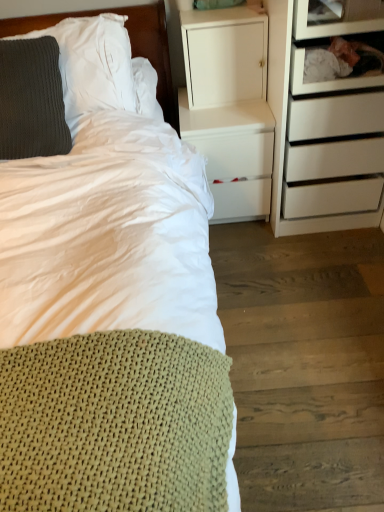
Identify the location of white matte nightstand at center. The width and height of the screenshot is (384, 512). (229, 106).

Locate an element on the screen. The image size is (384, 512). transparent glass shelf at upper right, which ranks as the 1th shelf in top-to-bottom order is located at coordinates (332, 24).

What is the approximate width of knitted gray pillow at left, which is the 1th pillow in top-to-bottom order?

knitted gray pillow at left, which is the 1th pillow in top-to-bottom order, is 18.86 inches wide.

Locate an element on the screen. wooden drawer at upper right, positioned as the 1th shelf in bottom-to-top order is located at coordinates (324, 81).

Would you say wooden drawer at upper right, positioned as the 1th shelf in bottom-to-top order, is a long distance from transparent glass shelf at upper right, which ranks as the 1th shelf in top-to-bottom order?

No, wooden drawer at upper right, positioned as the 1th shelf in bottom-to-top order, is in close proximity to transparent glass shelf at upper right, which ranks as the 1th shelf in top-to-bottom order.

Based on the photo, which object is positioned more to the right, wooden drawer at upper right, positioned as the 1th shelf in bottom-to-top order, or transparent glass shelf at upper right, which ranks as the 1th shelf in top-to-bottom order?

Positioned to the right is wooden drawer at upper right, positioned as the 1th shelf in bottom-to-top order.

Considering the positions of point (381, 81) and point (346, 23), is point (381, 81) closer or farther from the camera than point (346, 23)?

Clearly, point (381, 81) is more distant from the camera than point (346, 23).

Considering the positions of points (213, 46) and (349, 33), is point (213, 46) closer to camera compared to point (349, 33)?

No, it is not.

Considering the relative sizes of white matte cabinet at upper center and transparent glass shelf at upper right, the second shelf ordered from the bottom, in the image provided, is white matte cabinet at upper center wider than transparent glass shelf at upper right, the second shelf ordered from the bottom,?

No, white matte cabinet at upper center is not wider than transparent glass shelf at upper right, the second shelf ordered from the bottom.

Is white matte cabinet at upper center not close to transparent glass shelf at upper right, the second shelf ordered from the bottom?

That's not correct — white matte cabinet at upper center is a little close to transparent glass shelf at upper right, the second shelf ordered from the bottom.

Would you say knitted green blanket at lower left is a long distance from wooden drawer at upper right, positioned as the 1th shelf in bottom-to-top order?

Actually, knitted green blanket at lower left and wooden drawer at upper right, positioned as the 1th shelf in bottom-to-top order, are a little close together.

Find the location of a particular element. shelf that is the 1st one when counting upward from the knitted green blanket at lower left (from the image's perspective) is located at coordinates (324, 81).

From a real-world perspective, which object stands above the other?

wooden drawer at upper right, positioned as the 1th shelf in bottom-to-top order, from a real-world perspective.

Considering the sizes of objects knitted green blanket at lower left and wooden drawer at upper right, positioned as the 1th shelf in bottom-to-top order, in the image provided, who is smaller, knitted green blanket at lower left or wooden drawer at upper right, positioned as the 1th shelf in bottom-to-top order,?

Smaller between the two is wooden drawer at upper right, positioned as the 1th shelf in bottom-to-top order.

Which of these two, dark gray knitted pillow at upper left, the 2th pillow from the top, or knitted gray pillow at left, which ranks as the 2th pillow in bottom-to-top order, is thinner?

dark gray knitted pillow at upper left, the 2th pillow from the top, is thinner.

Is dark gray knitted pillow at upper left, positioned as the 1th pillow in bottom-to-top order, bigger than knitted gray pillow at left, which is the 1th pillow in top-to-bottom order?

Incorrect, dark gray knitted pillow at upper left, positioned as the 1th pillow in bottom-to-top order, is not larger than knitted gray pillow at left, which is the 1th pillow in top-to-bottom order.

Considering the positions of objects dark gray knitted pillow at upper left, the 2th pillow from the top, and knitted gray pillow at left, which is the 1th pillow in top-to-bottom order, in the image provided, who is behind, dark gray knitted pillow at upper left, the 2th pillow from the top, or knitted gray pillow at left, which is the 1th pillow in top-to-bottom order,?

knitted gray pillow at left, which is the 1th pillow in top-to-bottom order, is further from the camera.

Is dark gray knitted pillow at upper left, positioned as the 1th pillow in bottom-to-top order, thinner than wooden drawer at upper right, the 2th shelf from the top?

No, dark gray knitted pillow at upper left, positioned as the 1th pillow in bottom-to-top order, is not thinner than wooden drawer at upper right, the 2th shelf from the top.

Identify the location of the 1st pillow located above the wooden drawer at upper right, the 2th shelf from the top (from a real-world perspective). The width and height of the screenshot is (384, 512). [x=31, y=100].

From the image's perspective, would you say dark gray knitted pillow at upper left, positioned as the 1th pillow in bottom-to-top order, is shown under wooden drawer at upper right, the 2th shelf from the top?

Yes.

Is dark gray knitted pillow at upper left, the 2th pillow from the top, next to wooden drawer at upper right, positioned as the 1th shelf in bottom-to-top order, and touching it?

No, dark gray knitted pillow at upper left, the 2th pillow from the top, is not with wooden drawer at upper right, positioned as the 1th shelf in bottom-to-top order.

Is the position of transparent glass shelf at upper right, which ranks as the 1th shelf in top-to-bottom order, less distant than that of knitted green blanket at lower left?

No, transparent glass shelf at upper right, which ranks as the 1th shelf in top-to-bottom order, is behind knitted green blanket at lower left.

From the image's perspective, is transparent glass shelf at upper right, which ranks as the 1th shelf in top-to-bottom order, above knitted green blanket at lower left?

Yes.

Can you tell me how much transparent glass shelf at upper right, which ranks as the 1th shelf in top-to-bottom order, and knitted green blanket at lower left differ in facing direction?

0.154 degrees.

Visually, is transparent glass shelf at upper right, which ranks as the 1th shelf in top-to-bottom order, positioned to the left or to the right of knitted green blanket at lower left?

Clearly, transparent glass shelf at upper right, which ranks as the 1th shelf in top-to-bottom order, is on the right of knitted green blanket at lower left in the image.

Between wooden drawer at upper right, the 2th shelf from the top, and knitted gray pillow at left, which is the 1th pillow in top-to-bottom order, which one has larger size?

knitted gray pillow at left, which is the 1th pillow in top-to-bottom order, is bigger.

Locate an element on the screen. This screenshot has width=384, height=512. pillow that is the 2nd object above the wooden drawer at upper right, the 2th shelf from the top (from a real-world perspective) is located at coordinates (93, 64).

From the image's perspective, is wooden drawer at upper right, the 2th shelf from the top, located beneath knitted gray pillow at left, which ranks as the 2th pillow in bottom-to-top order?

Actually, wooden drawer at upper right, the 2th shelf from the top, appears above knitted gray pillow at left, which ranks as the 2th pillow in bottom-to-top order, in the image.

Can you confirm if wooden drawer at upper right, the 2th shelf from the top, is taller than knitted gray pillow at left, which is the 1th pillow in top-to-bottom order?

No, wooden drawer at upper right, the 2th shelf from the top, is not taller than knitted gray pillow at left, which is the 1th pillow in top-to-bottom order.

Where is `shelf located underneath the transparent glass shelf at upper right, the second shelf ordered from the bottom (from a real-world perspective)`? This screenshot has width=384, height=512. shelf located underneath the transparent glass shelf at upper right, the second shelf ordered from the bottom (from a real-world perspective) is located at coordinates (324, 81).

Find the location of a particular element. This screenshot has width=384, height=512. cabinetry that appears on the left of transparent glass shelf at upper right, which ranks as the 1th shelf in top-to-bottom order is located at coordinates (224, 56).

Considering their positions, is transparent glass shelf at upper right, which ranks as the 1th shelf in top-to-bottom order, positioned closer to white matte nightstand at center than wooden drawer at upper right, positioned as the 1th shelf in bottom-to-top order?

The object closer to white matte nightstand at center is wooden drawer at upper right, positioned as the 1th shelf in bottom-to-top order.

Estimate the real-world distances between objects in this image. Which object is further from white matte cabinet at upper center, knitted gray pillow at left, which ranks as the 2th pillow in bottom-to-top order, or dark gray knitted pillow at upper left, the 2th pillow from the top?

dark gray knitted pillow at upper left, the 2th pillow from the top, is further to white matte cabinet at upper center.

In the scene shown: Which object lies further to the anchor point wooden drawer at upper right, positioned as the 1th shelf in bottom-to-top order, white matte nightstand at center or knitted gray pillow at left, which is the 1th pillow in top-to-bottom order?

knitted gray pillow at left, which is the 1th pillow in top-to-bottom order.

Based on their spatial positions, is white matte nightstand at center or wooden drawer at upper right, positioned as the 1th shelf in bottom-to-top order, closer to knitted gray pillow at left, which is the 1th pillow in top-to-bottom order?

white matte nightstand at center.

When comparing their distances from white matte cabinet at upper center, does transparent glass shelf at upper right, which ranks as the 1th shelf in top-to-bottom order, or wooden drawer at upper right, the 2th shelf from the top, seem closer?

wooden drawer at upper right, the 2th shelf from the top, is positioned closer to the anchor white matte cabinet at upper center.

Which object lies further to the anchor point dark gray knitted pillow at upper left, positioned as the 1th pillow in bottom-to-top order, knitted green blanket at lower left or transparent glass shelf at upper right, the second shelf ordered from the bottom?

transparent glass shelf at upper right, the second shelf ordered from the bottom.

Looking at the image, which one is located further to wooden drawer at upper right, the 2th shelf from the top, dark gray knitted pillow at upper left, positioned as the 1th pillow in bottom-to-top order, or white matte nightstand at center?

dark gray knitted pillow at upper left, positioned as the 1th pillow in bottom-to-top order.

Looking at the image, which one is located further to wooden drawer at upper right, the 2th shelf from the top, knitted gray pillow at left, which is the 1th pillow in top-to-bottom order, or knitted green blanket at lower left?

The object further to wooden drawer at upper right, the 2th shelf from the top, is knitted green blanket at lower left.

Locate an element on the screen. cabinetry located between knitted gray pillow at left, which ranks as the 2th pillow in bottom-to-top order, and wooden drawer at upper right, positioned as the 1th shelf in bottom-to-top order, in the left-right direction is located at coordinates coord(224,56).

You are a GUI agent. You are given a task and a screenshot of the screen. Output one action in this format:
    pyautogui.click(x=<x>, y=<y>)
    Task: Click on the nightstand located between knitted gray pillow at left, which is the 1th pillow in top-to-bottom order, and wooden drawer at upper right, positioned as the 1th shelf in bottom-to-top order, in the left-right direction
    This screenshot has height=512, width=384.
    Given the screenshot: What is the action you would take?
    click(x=229, y=106)

Identify the location of nightstand situated between knitted gray pillow at left, which ranks as the 2th pillow in bottom-to-top order, and transparent glass shelf at upper right, which ranks as the 1th shelf in top-to-bottom order, from left to right. The width and height of the screenshot is (384, 512). (229, 106).

Locate an element on the screen. The height and width of the screenshot is (512, 384). pillow located between knitted green blanket at lower left and knitted gray pillow at left, which ranks as the 2th pillow in bottom-to-top order, in the depth direction is located at coordinates (31, 100).